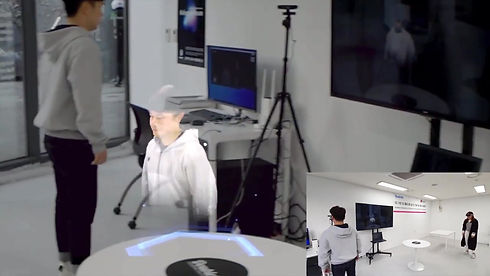
At what (x,y) coordinates should I click in order to perform the action: click on ceiling light. Please return your answer as a coordinate pair (x, y). Looking at the image, I should click on (479, 187).